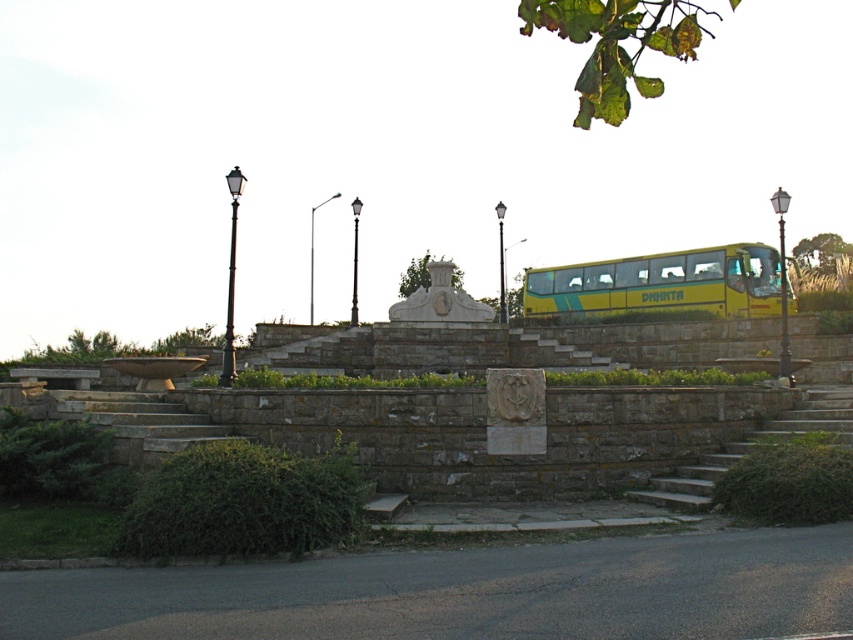
Is yellow/green painted bus at right positioned in front of stone steps at lower right?

That is False.

Is point (730, 278) farther from camera compared to point (813, 394)?

Yes.

The height and width of the screenshot is (640, 853). Identify the location of yellow/green painted bus at right. coord(665,284).